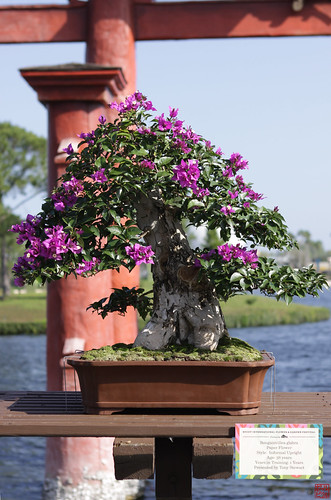
The width and height of the screenshot is (331, 500). I want to click on table, so click(15, 417), click(43, 397), click(310, 396).